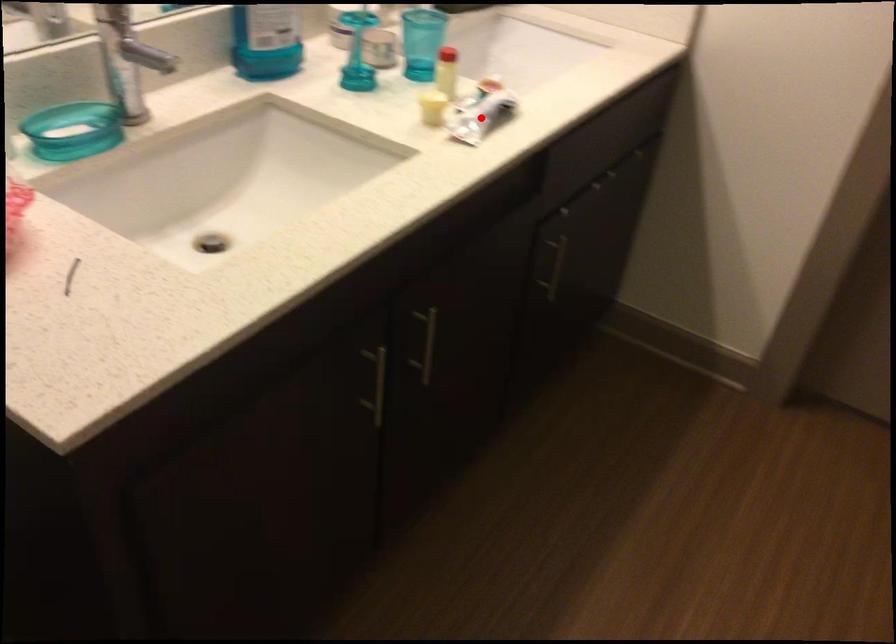
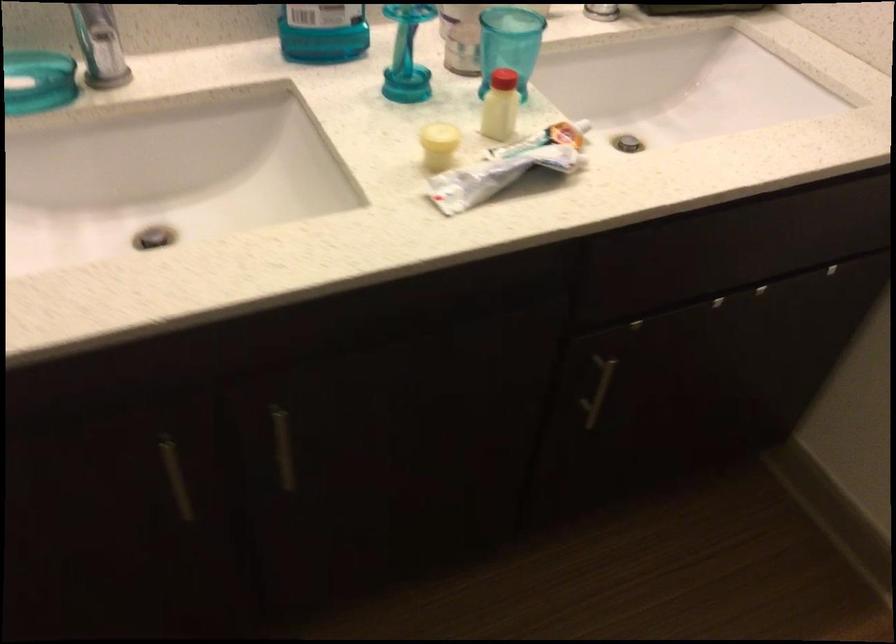
Locate, in the second image, the point that corresponds to the highlighted location in the first image.

(495, 176)